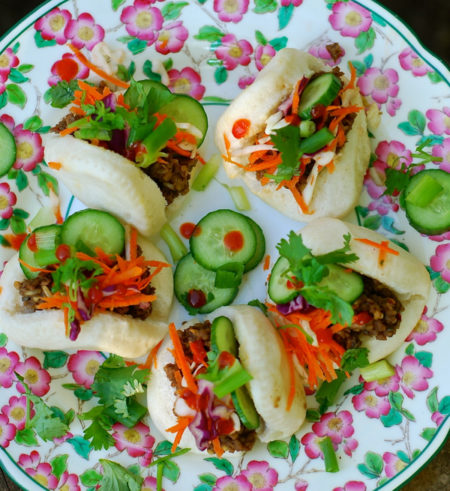
Image resolution: width=450 pixels, height=491 pixels. I want to click on white plate border, so click(395, 21).